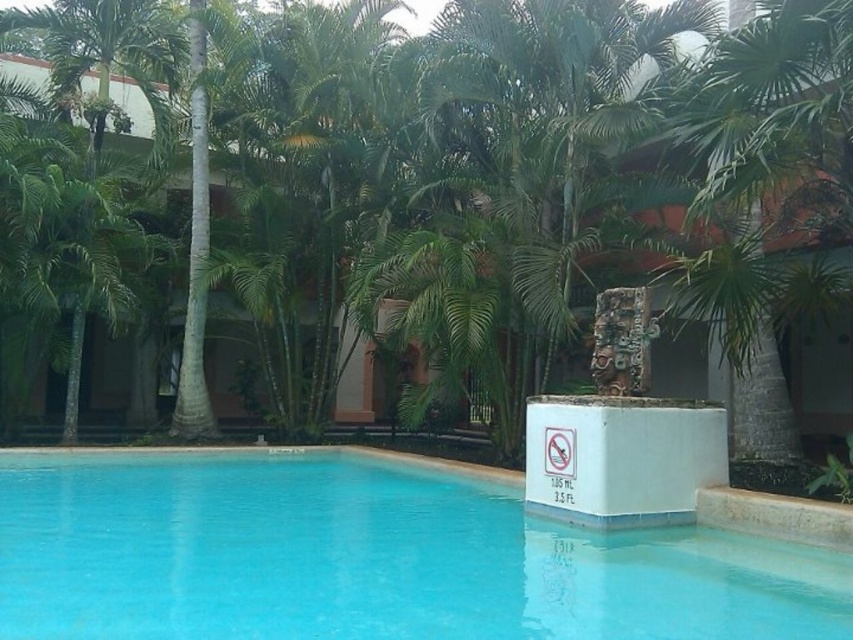
From the picture: Is blue glossy water at center shorter than green leafy palm tree at center?

Yes.

Is point (288, 472) positioned behind point (761, 83)?

Yes, it is behind point (761, 83).

Where is `blue glossy water at center`? blue glossy water at center is located at coordinates (369, 557).

Where is `blue glossy water at center`? blue glossy water at center is located at coordinates (369, 557).